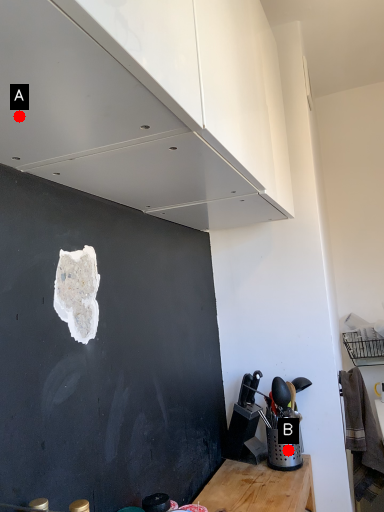
Question: Two points are circled on the image, labeled by A and B beside each circle. Which of the following is the farthest from the observer?

Choices:
 (A) A is further
 (B) B is further

Answer: (B)